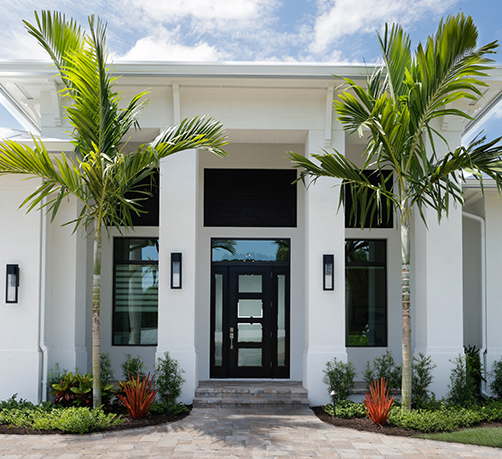
In order to click on door handle in this screenshot , I will do `click(231, 333)`.